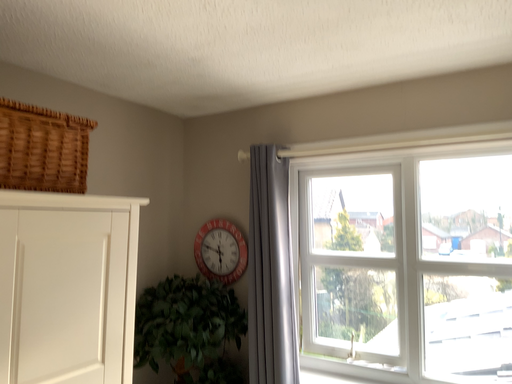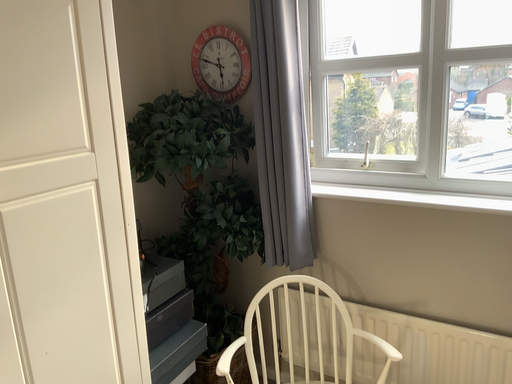
Question: Which way did the camera rotate in the video?

Choices:
 (A) rotated upward
 (B) rotated downward

Answer: (B)